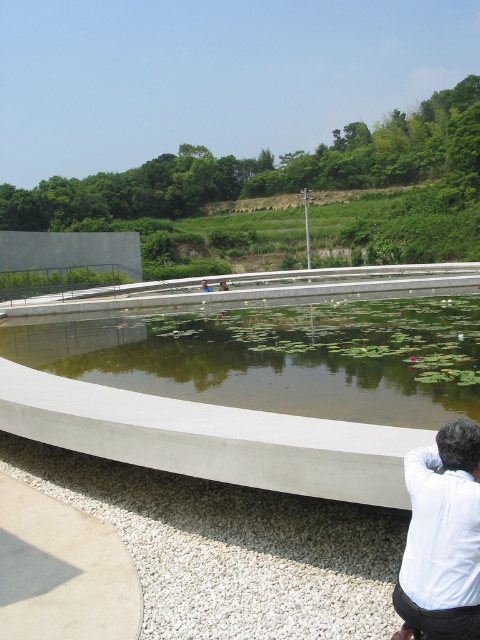
Question: Can you confirm if green concrete pond at center is bigger than white matte shirt at lower right?

Choices:
 (A) no
 (B) yes

Answer: (B)

Question: Among these points, which one is farthest from the camera?

Choices:
 (A) (441, 524)
 (B) (397, 419)

Answer: (B)

Question: Is green concrete pond at center bigger than white matte shirt at lower right?

Choices:
 (A) yes
 (B) no

Answer: (A)

Question: Can you confirm if green concrete pond at center is thinner than white matte shirt at lower right?

Choices:
 (A) no
 (B) yes

Answer: (A)

Question: Which object is closer to the camera taking this photo?

Choices:
 (A) white matte shirt at lower right
 (B) green concrete pond at center

Answer: (A)